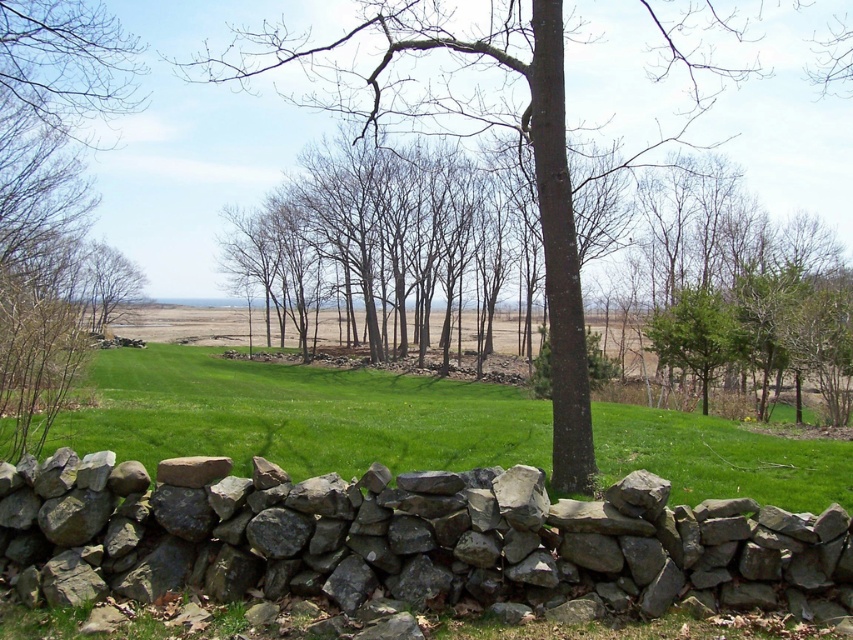
Question: Can you confirm if green grass at center is positioned to the right of brown rough bark tree at center?

Choices:
 (A) yes
 (B) no

Answer: (B)

Question: In this image, where is green grass at center located relative to bare branches at left?

Choices:
 (A) above
 (B) below

Answer: (B)

Question: Which point is farther to the camera?

Choices:
 (A) (792, 449)
 (B) (482, 67)
 (C) (22, 93)

Answer: (B)

Question: Which of the following is the closest to the observer?

Choices:
 (A) (76, 48)
 (B) (500, 452)

Answer: (B)

Question: Is gray rough stone wall at center below green grass at center?

Choices:
 (A) no
 (B) yes

Answer: (A)

Question: Which point is farther from the camera taking this photo?

Choices:
 (A) pyautogui.click(x=263, y=417)
 (B) pyautogui.click(x=315, y=61)
 (C) pyautogui.click(x=152, y=550)
 (D) pyautogui.click(x=85, y=275)

Answer: (B)